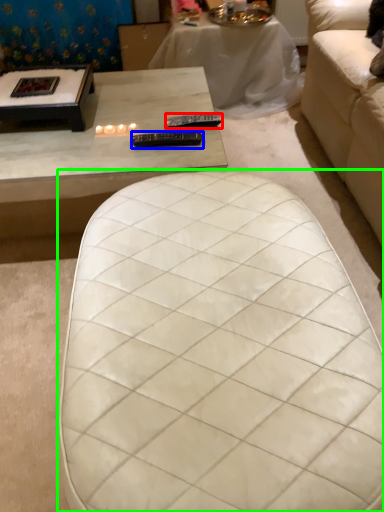
Question: Which object is positioned farthest from remote (highlighted by a red box)? Select from remote (highlighted by a blue box) and table (highlighted by a green box).

Choices:
 (A) remote
 (B) table

Answer: (B)